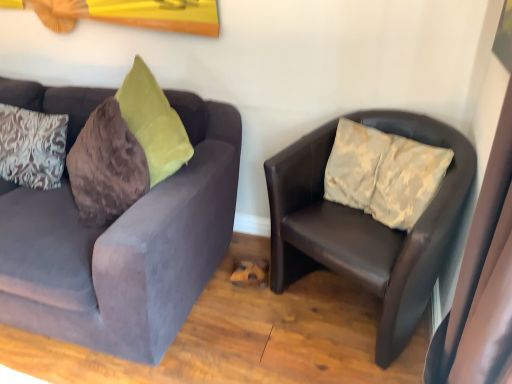
Question: Considering the positions of velvet gray couch at left, the 2th studio couch viewed from the right, and leather chair at right, acting as the 1th studio couch starting from the right, in the image, is velvet gray couch at left, the 2th studio couch viewed from the right, bigger or smaller than leather chair at right, acting as the 1th studio couch starting from the right,?

Choices:
 (A) small
 (B) big

Answer: (B)

Question: Choose the correct answer: Is velvet gray couch at left, the 2th studio couch viewed from the right, inside leather chair at right, acting as the 1th studio couch starting from the right, or outside it?

Choices:
 (A) outside
 (B) inside

Answer: (A)

Question: Considering the real-world distances, which object is farthest from the velvet gray couch at left, the 2th studio couch viewed from the right?

Choices:
 (A) leather chair at right, the 2th studio couch viewed from the left
 (B) white damask pillow at left

Answer: (A)

Question: Estimate the real-world distances between objects in this image. Which object is closer to the white damask pillow at left?

Choices:
 (A) velvet gray couch at left, which ranks as the first studio couch in left-to-right order
 (B) leather chair at right, the 2th studio couch viewed from the left

Answer: (A)